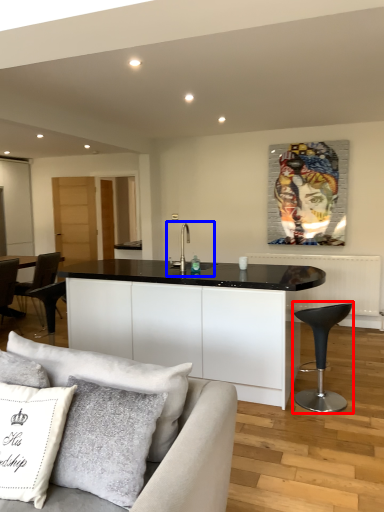
Question: Which point is further to the camera, bar stool (highlighted by a red box) or sink (highlighted by a blue box)?

Choices:
 (A) bar stool
 (B) sink

Answer: (B)